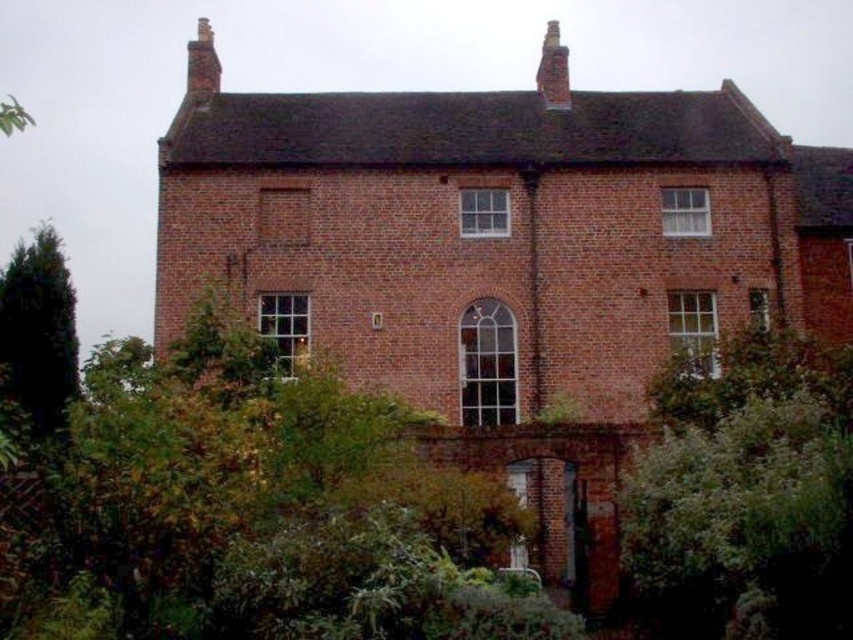
From the picture: Is red brick chimney at upper center smaller than red brick chimney at upper left?

Indeed, red brick chimney at upper center has a smaller size compared to red brick chimney at upper left.

How far apart are red brick chimney at upper center and red brick chimney at upper left?

The distance of red brick chimney at upper center from red brick chimney at upper left is 25.91 meters.

Find the location of a particular element. The height and width of the screenshot is (640, 853). red brick chimney at upper center is located at coordinates (553, 70).

Is green leafy tree at left positioned before red brick chimney at upper left?

Yes.

Is green leafy tree at left bigger than red brick chimney at upper left?

Yes, green leafy tree at left is bigger than red brick chimney at upper left.

Does point (54, 372) come farther from viewer compared to point (218, 60)?

No.

Where is `green leafy tree at left`? This screenshot has height=640, width=853. green leafy tree at left is located at coordinates (39, 330).

Which is above, green leafy tree at left or red brick chimney at upper center?

red brick chimney at upper center is above.

Does green leafy tree at left appear on the right side of red brick chimney at upper center?

No, green leafy tree at left is not to the right of red brick chimney at upper center.

Does point (3, 308) come closer to viewer compared to point (548, 76)?

Yes, point (3, 308) is in front of point (548, 76).

At what (x,y) coordinates should I click in order to perform the action: click on green leafy tree at left. Please return your answer as a coordinate pair (x, y). The width and height of the screenshot is (853, 640). Looking at the image, I should click on (39, 330).